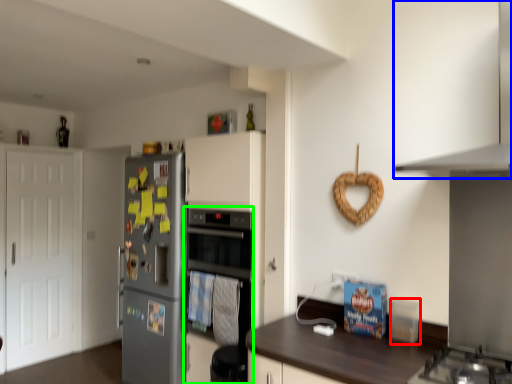
Question: Estimate the real-world distances between objects in this image. Which object is farther from appliance (highlighted by a red box), exhaust hood (highlighted by a blue box) or oven (highlighted by a green box)?

Choices:
 (A) exhaust hood
 (B) oven

Answer: (B)